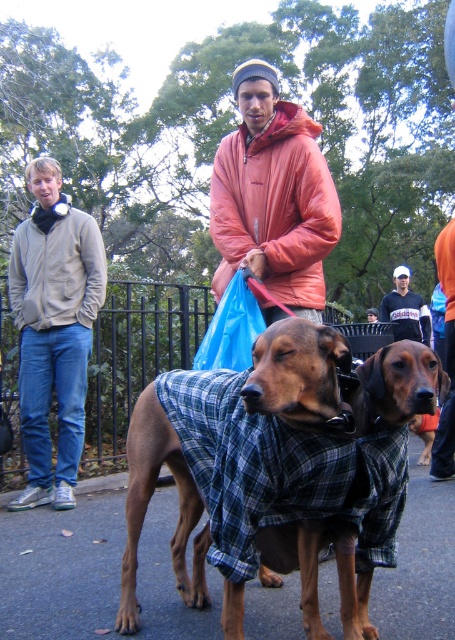
Identify the location of matte gray hoodie at left. (54, 330).

Is matte gray hoodie at left smaller than black cotton shirt at center?

Correct, matte gray hoodie at left occupies less space than black cotton shirt at center.

Locate an element on the screen. matte gray hoodie at left is located at coordinates (54, 330).

Between brushed metal jacket at left and black cotton shirt at center, which one has more height?

black cotton shirt at center is taller.

Between brushed metal jacket at left and black cotton shirt at center, which one appears on the left side from the viewer's perspective?

brushed metal jacket at left

I want to click on brushed metal jacket at left, so click(56, 273).

Can you confirm if orange puffy jacket at center is shorter than brown plaid coat at center?

No.

Who is lower down, orange puffy jacket at center or brown plaid coat at center?

brown plaid coat at center

Does point (297, 195) lie behind point (186, 531)?

Yes, it is behind point (186, 531).

Image resolution: width=455 pixels, height=640 pixels. What are the coordinates of `orange puffy jacket at center` in the screenshot? It's located at (274, 205).